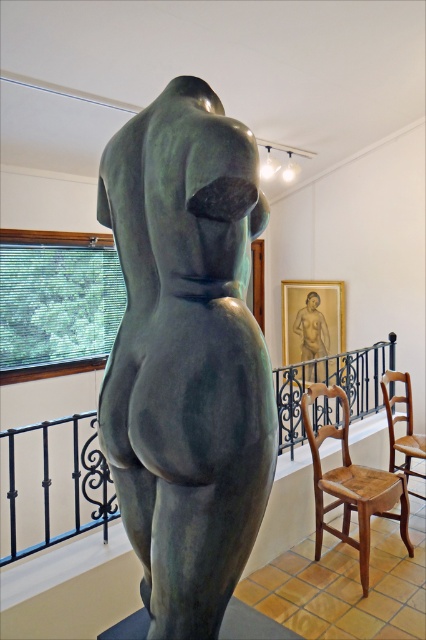
You are standing in the art gallery and want to take a photo of the bronze statue at center. Where should you position yourself to ensure the statue is in the center of your camera frame?

To center the bronze statue at center in your camera frame, position yourself directly in front of the coordinates point at point (x=187, y=355) where the statue is located.

You are standing in the room and want to move towards the dark green metal balustrade at center. Based on its coordinates, in which direction should you move from your current position at point 0,0?

The dark green metal balustrade at center is located at point (x=71, y=477), so you should move towards the right and slightly forward from your current position at (x=0, y=0).